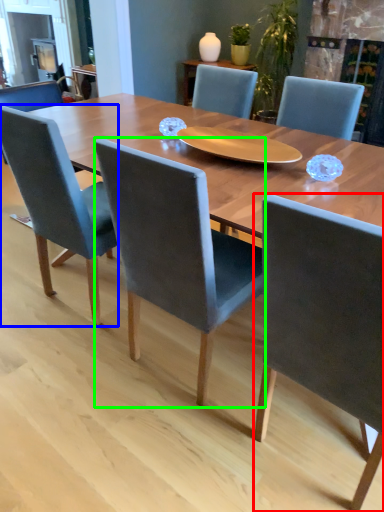
Question: Estimate the real-world distances between objects in this image. Which object is farther from chair (highlighted by a red box), chair (highlighted by a blue box) or chair (highlighted by a green box)?

Choices:
 (A) chair
 (B) chair

Answer: (A)